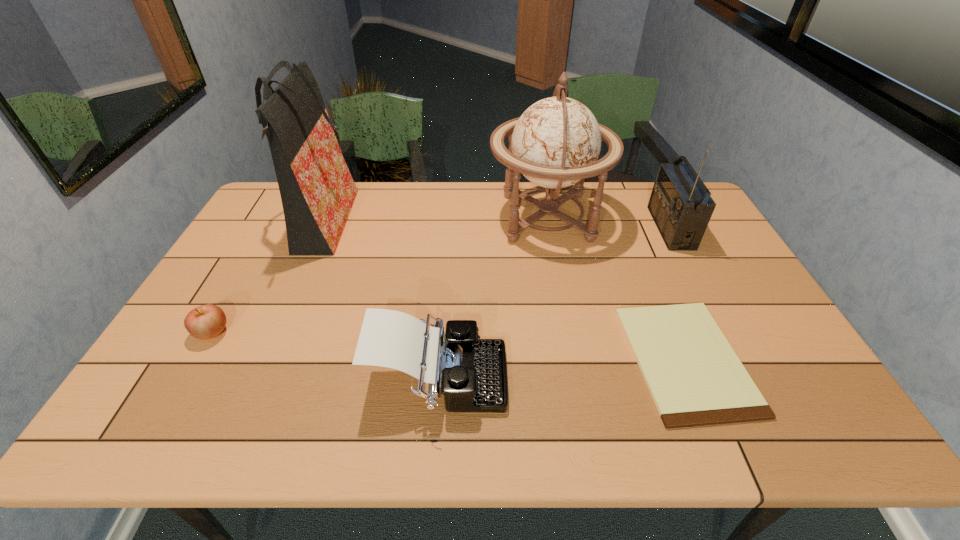
At what (x,y) coordinates should I click in order to perform the action: click on the fifth object from right to left. Please return your answer as a coordinate pair (x, y). This screenshot has width=960, height=540. Looking at the image, I should click on (317, 191).

The image size is (960, 540). Identify the location of globe. (556, 142).

This screenshot has height=540, width=960. Identify the location of the third tallest object. (680, 204).

This screenshot has height=540, width=960. I want to click on the fourth tallest object, so click(x=471, y=372).

Locate an element on the screen. The image size is (960, 540). the leftmost object is located at coordinates (204, 322).

This screenshot has width=960, height=540. I want to click on the second shortest object, so click(x=204, y=322).

This screenshot has width=960, height=540. Identify the location of clipboard. click(695, 378).

Identify the location of vacant space located 0.160m on the front side of the shopping bag. [x=400, y=225].

Locate an element on the screen. Image resolution: width=960 pixels, height=540 pixels. vacant space positioned on the front-facing side of the globe is located at coordinates (419, 217).

Where is `vacant space located on the front-facing side of the globe`? vacant space located on the front-facing side of the globe is located at coordinates (421, 217).